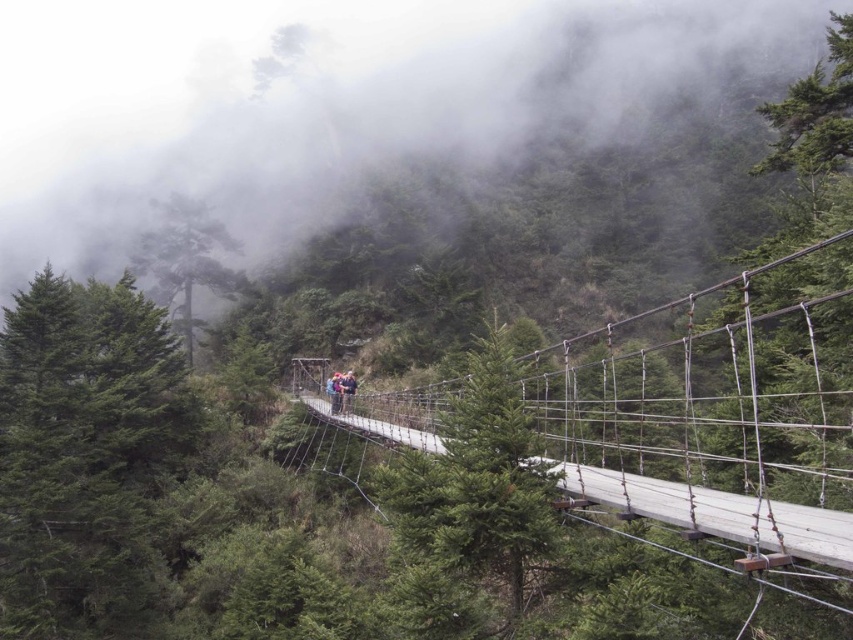
You are a hiker standing on the wooden suspension bridge at center. You look up and see the white foggy cloud at upper center. Which object is closer to you, the bridge or the cloud?

The white foggy cloud at upper center is closer to you because the wooden suspension bridge at center is behind it.

You are standing on the suspension bridge and looking towards the dark blue jeans at center. Which direction should you look to see the white foggy cloud at upper center?

The white foggy cloud at upper center is above the dark blue jeans at center, so you should look upwards to see it.